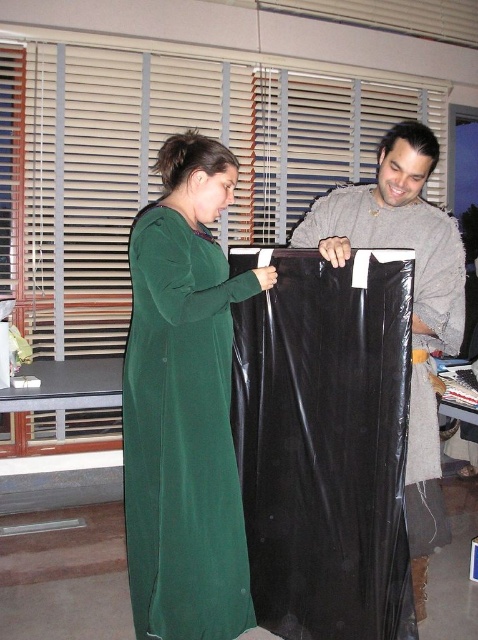
Question: Based on their relative distances, which object is nearer to the matte black plastic bag at center?

Choices:
 (A) black plastic bag at center
 (B) green velvet dress at center

Answer: (A)

Question: Among these objects, which one is nearest to the camera?

Choices:
 (A) matte black plastic bag at center
 (B) green velvet dress at center

Answer: (A)

Question: Which object is positioned farthest from the green velvet dress at center?

Choices:
 (A) matte black plastic bag at center
 (B) black plastic bag at center

Answer: (A)

Question: Is green velvet dress at center positioned behind matte black plastic bag at center?

Choices:
 (A) yes
 (B) no

Answer: (A)

Question: Is green velvet dress at center above matte black plastic bag at center?

Choices:
 (A) no
 (B) yes

Answer: (B)

Question: Is black plastic bag at center positioned before matte black plastic bag at center?

Choices:
 (A) yes
 (B) no

Answer: (A)